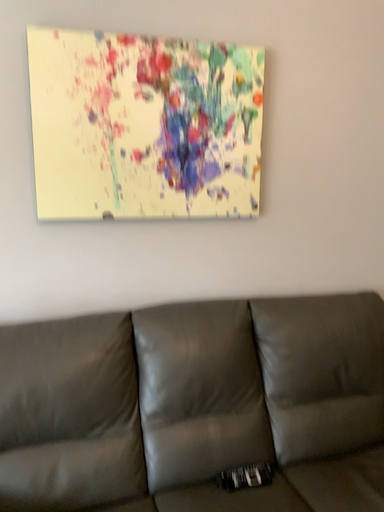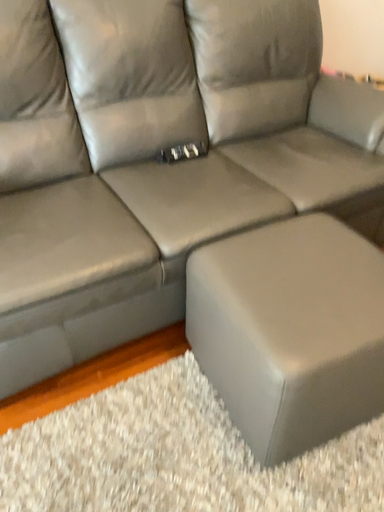
Question: Which way did the camera rotate in the video?

Choices:
 (A) rotated downward
 (B) rotated upward

Answer: (A)